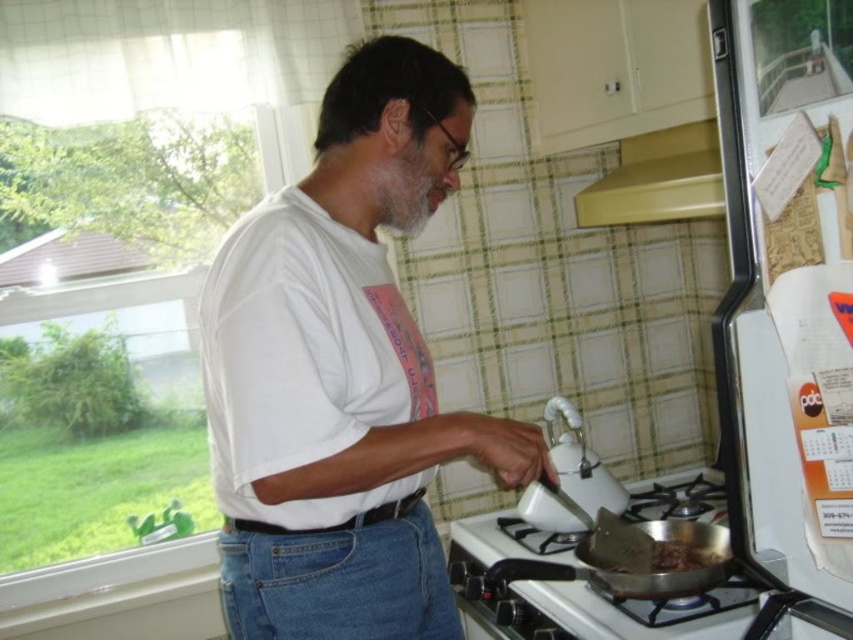
Question: Considering the real-world distances, which object is farthest from the silver metallic frying pan at lower right?

Choices:
 (A) white glossy kettle at upper center
 (B) white glossy gas stove at lower center

Answer: (A)

Question: Which object appears farthest from the camera in this image?

Choices:
 (A) white glossy gas stove at lower center
 (B) yellow matte exhaust hood at upper center
 (C) white glossy kettle at upper center

Answer: (C)

Question: Among these points, which one is farthest from the camera?

Choices:
 (A) (645, 518)
 (B) (633, 150)

Answer: (B)

Question: Is the position of white matte shirt at center more distant than that of white glossy gas stove at lower center?

Choices:
 (A) no
 (B) yes

Answer: (A)

Question: Can you confirm if white glossy gas stove at lower center is thinner than silver metallic frying pan at lower right?

Choices:
 (A) no
 (B) yes

Answer: (A)

Question: Does white glossy gas stove at lower center have a lesser width compared to silver metallic frying pan at lower right?

Choices:
 (A) yes
 (B) no

Answer: (B)